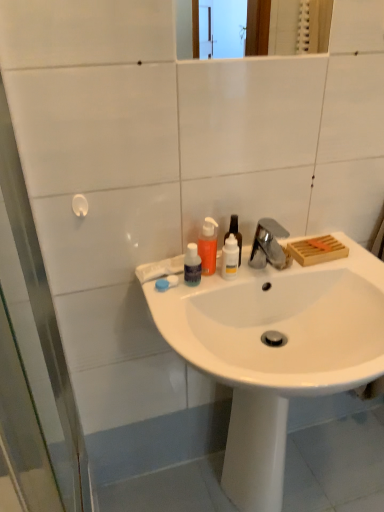
Locate an element on the screen. Image resolution: width=384 pixels, height=512 pixels. free point in front of translucent orange liquid at sink center, the 2th bottle in the left-to-right sequence is located at coordinates (184, 303).